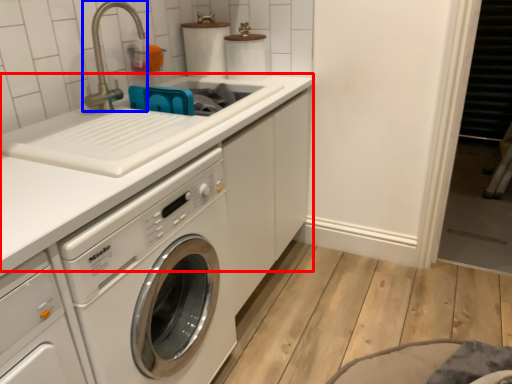
Question: Which object appears farthest to the camera in this image, counter top (highlighted by a red box) or faucet (highlighted by a blue box)?

Choices:
 (A) counter top
 (B) faucet

Answer: (B)